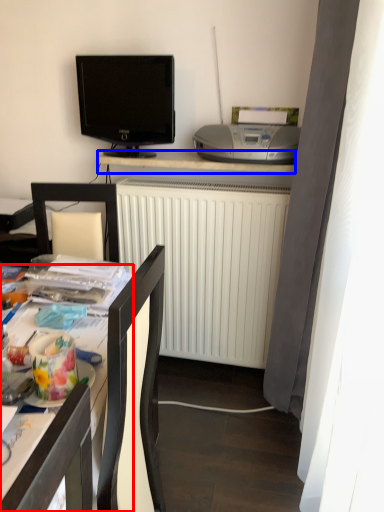
Question: Which object appears farthest to the camera in this image, desk (highlighted by a red box) or desk (highlighted by a blue box)?

Choices:
 (A) desk
 (B) desk

Answer: (B)